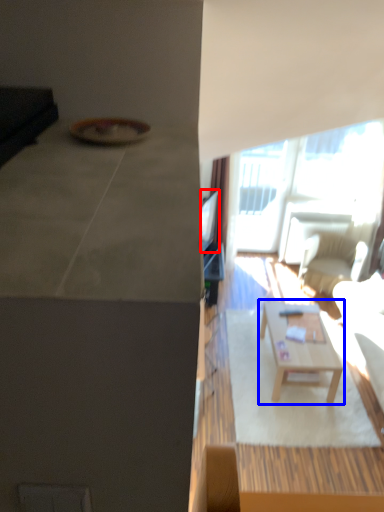
Question: Among these objects, which one is nearest to the camera, television (highlighted by a red box) or coffee table (highlighted by a blue box)?

Choices:
 (A) television
 (B) coffee table

Answer: (B)